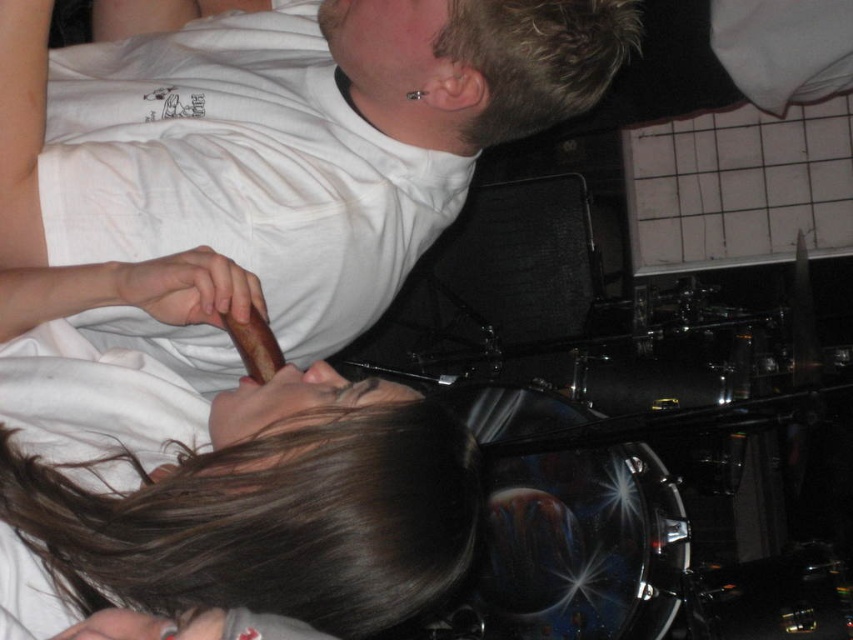
You are standing in the scene and want to reach both point A at point (314, 65) and point B at point (447, 531). Which point will you reach first if you move straight ahead?

You will reach point A at point (314, 65) first because it is closer to you than point B at point (447, 531).